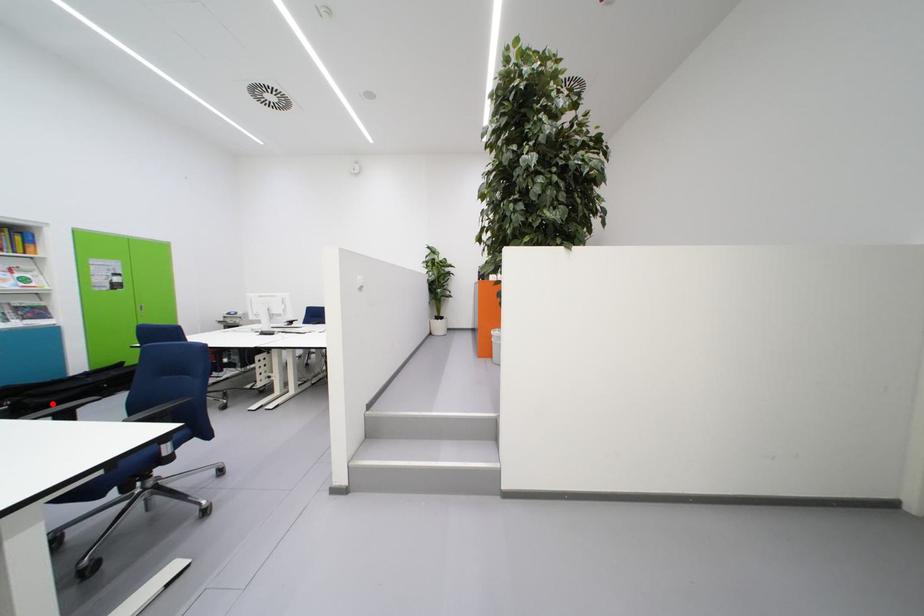
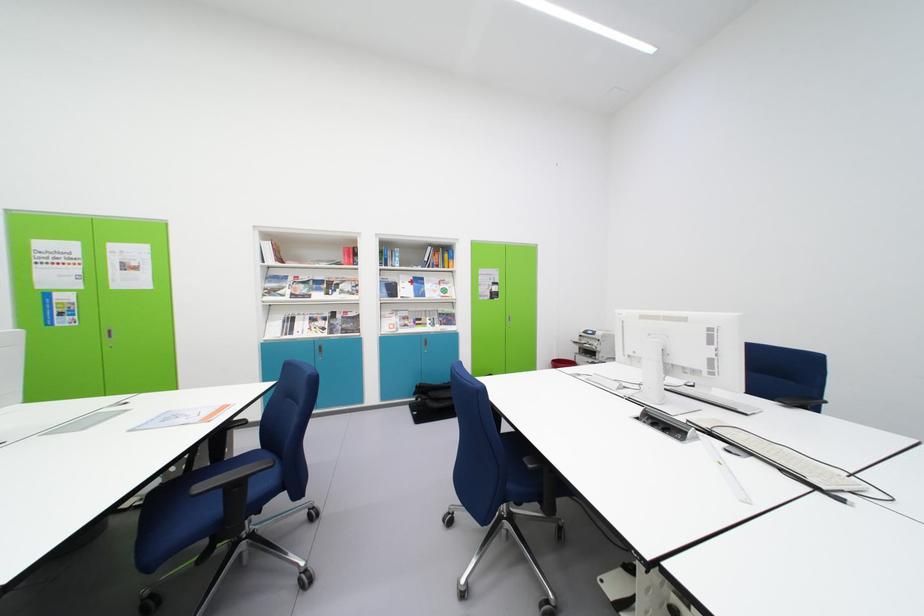
Question: I am providing you with two images of the same scene from different viewpoints. A red point is marked on the first image. At the location where the point appears in image 1, is it still visible in image 2?

Choices:
 (A) Yes
 (B) No

Answer: (A)